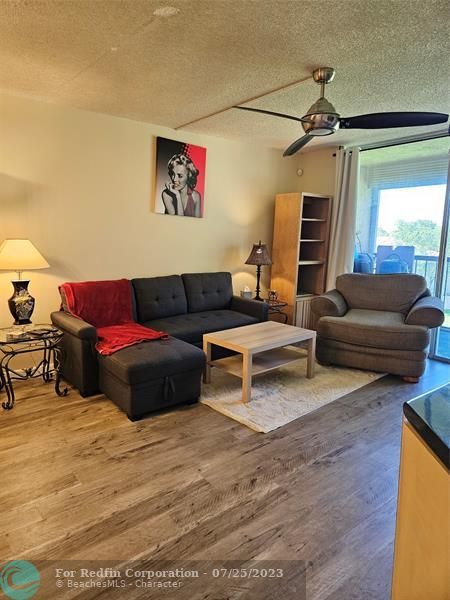
Where is `floor`? floor is located at coordinates tap(120, 479).